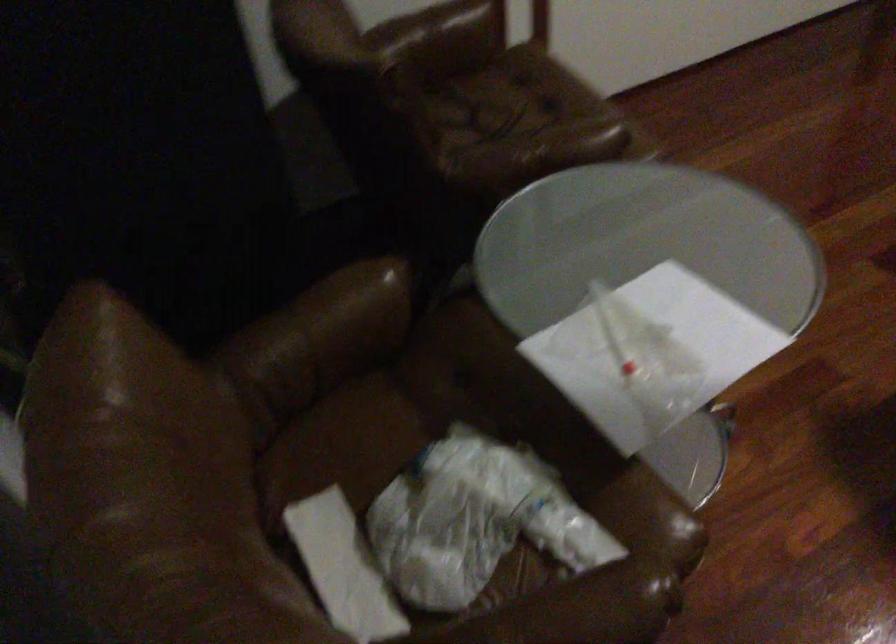
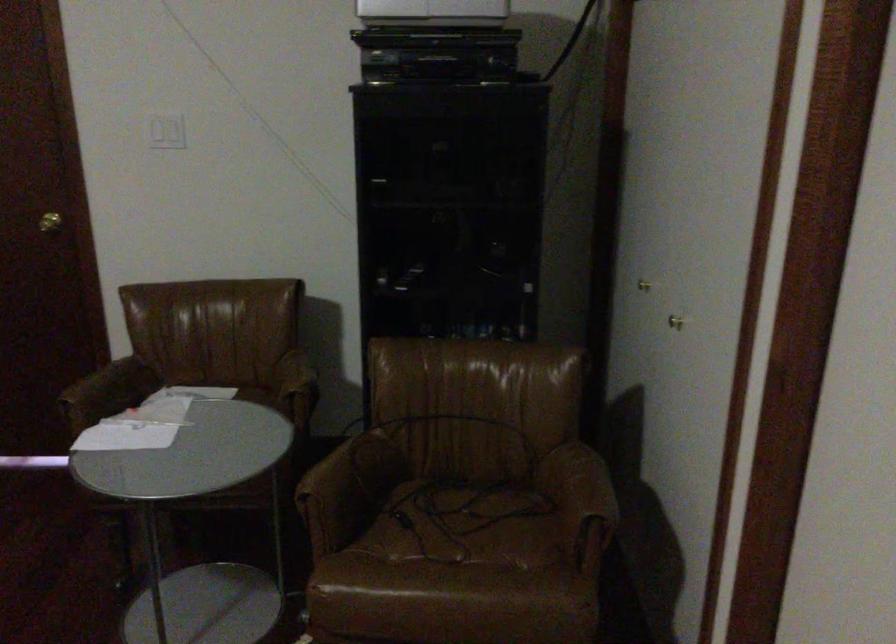
Where in the second image is the point corresponding to point 484,126 from the first image?

(464, 525)